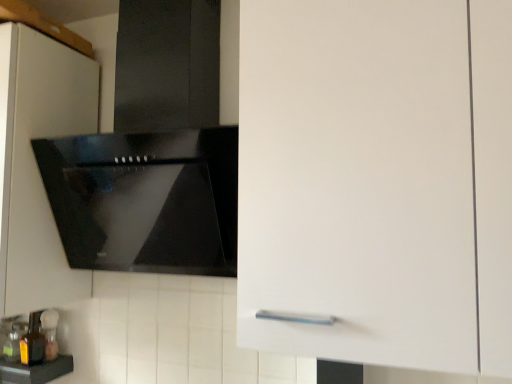
Image resolution: width=512 pixels, height=384 pixels. What do you see at coordinates (32, 341) in the screenshot?
I see `translucent amber bottle at lower left, which appears as the 1th bottle when viewed from the front` at bounding box center [32, 341].

Find the location of a particular element. This screenshot has width=512, height=384. translucent amber bottle at lower left, which appears as the 1th bottle when viewed from the front is located at coordinates (32, 341).

Find the location of a particular element. white matte cabinet at upper left is located at coordinates (36, 164).

This screenshot has width=512, height=384. What do you see at coordinates (49, 333) in the screenshot? I see `translucent glass bottle at lower left, marked as the second bottle in a front-to-back arrangement` at bounding box center [49, 333].

Image resolution: width=512 pixels, height=384 pixels. What do you see at coordinates (35, 370) in the screenshot?
I see `black glossy countertop at lower left` at bounding box center [35, 370].

Image resolution: width=512 pixels, height=384 pixels. In order to click on translucent amber bottle at lower left, which appears as the 1th bottle when viewed from the front in this screenshot , I will do tap(32, 341).

Does translucent amber bottle at lower left, which appears as the 1th bottle when viewed from the front, have a larger size compared to white matte cabinet at upper left?

No, translucent amber bottle at lower left, which appears as the 1th bottle when viewed from the front, is not bigger than white matte cabinet at upper left.

From the picture: Is translucent amber bottle at lower left, which appears as the 1th bottle when viewed from the front, inside or outside of white matte cabinet at upper left?

translucent amber bottle at lower left, which appears as the 1th bottle when viewed from the front, is located beyond the bounds of white matte cabinet at upper left.

Is translucent amber bottle at lower left, which appears as the 1th bottle when viewed from the front, oriented away from white matte cabinet at upper left?

No.

Based on the photo, which object is positioned more to the right, translucent amber bottle at lower left, positioned as the second bottle in back-to-front order, or white matte cabinet at upper left?

translucent amber bottle at lower left, positioned as the second bottle in back-to-front order.

Can you tell me how much black glossy countertop at lower left and translucent amber bottle at lower left, which appears as the 1th bottle when viewed from the front, differ in facing direction?

There is a 1.38-degree angle between the facing directions of black glossy countertop at lower left and translucent amber bottle at lower left, which appears as the 1th bottle when viewed from the front.

Could you tell me if black glossy countertop at lower left is facing translucent amber bottle at lower left, which appears as the 1th bottle when viewed from the front?

No, black glossy countertop at lower left is not turned towards translucent amber bottle at lower left, which appears as the 1th bottle when viewed from the front.

This screenshot has height=384, width=512. I want to click on bottle that is the 1st object to the right of the black glossy countertop at lower left, starting at the anchor, so click(x=32, y=341).

Is black glossy countertop at lower left smaller than translucent amber bottle at lower left, positioned as the second bottle in back-to-front order?

Incorrect, black glossy countertop at lower left is not smaller in size than translucent amber bottle at lower left, positioned as the second bottle in back-to-front order.

From the image's perspective, which one is positioned lower, black glossy countertop at lower left or white matte cabinet at upper left?

black glossy countertop at lower left appears lower in the image.

From a real-world perspective, which is physically below, black glossy countertop at lower left or white matte cabinet at upper left?

black glossy countertop at lower left.

Considering the relative positions of black glossy countertop at lower left and white matte cabinet at upper left in the image provided, is black glossy countertop at lower left in front of white matte cabinet at upper left?

Answer: No, the depth of black glossy countertop at lower left is greater than that of white matte cabinet at upper left.

Between white matte cabinet at upper left and translucent glass bottle at lower left, marked as the second bottle in a front-to-back arrangement, which one has larger width?

With larger width is white matte cabinet at upper left.

How different are the orientations of white matte cabinet at upper left and translucent glass bottle at lower left, marked as the second bottle in a front-to-back arrangement, in degrees?

0.129 degrees.

Can you confirm if white matte cabinet at upper left is shorter than translucent glass bottle at lower left, which ranks as the 1th bottle in back-to-front order?

In fact, white matte cabinet at upper left may be taller than translucent glass bottle at lower left, which ranks as the 1th bottle in back-to-front order.

Between white matte cabinet at upper left and translucent glass bottle at lower left, marked as the second bottle in a front-to-back arrangement, which one has larger size?

Bigger between the two is white matte cabinet at upper left.

From a real-world perspective, is translucent glass bottle at lower left, which ranks as the 1th bottle in back-to-front order, beneath black glossy countertop at lower left?

Actually, translucent glass bottle at lower left, which ranks as the 1th bottle in back-to-front order, is physically above black glossy countertop at lower left in the real world.

From the image's perspective, which is below, translucent glass bottle at lower left, marked as the second bottle in a front-to-back arrangement, or black glossy countertop at lower left?

black glossy countertop at lower left.

Is translucent glass bottle at lower left, which ranks as the 1th bottle in back-to-front order, placed right next to black glossy countertop at lower left?

Yes, the surface of translucent glass bottle at lower left, which ranks as the 1th bottle in back-to-front order, is in contact with black glossy countertop at lower left.

Would you say translucent amber bottle at lower left, which appears as the 1th bottle when viewed from the front, contains black glossy countertop at lower left?

Answer: No, translucent amber bottle at lower left, which appears as the 1th bottle when viewed from the front, does not contain black glossy countertop at lower left.

Based on the photo, is translucent amber bottle at lower left, positioned as the second bottle in back-to-front order, not close to black glossy countertop at lower left?

No.

Which of these two, translucent amber bottle at lower left, which appears as the 1th bottle when viewed from the front, or black glossy countertop at lower left, is bigger?

Bigger between the two is black glossy countertop at lower left.

In terms of height, does translucent amber bottle at lower left, positioned as the second bottle in back-to-front order, look taller or shorter compared to black glossy countertop at lower left?

translucent amber bottle at lower left, positioned as the second bottle in back-to-front order, is taller than black glossy countertop at lower left.

Consider the image. Does translucent amber bottle at lower left, positioned as the second bottle in back-to-front order, have a greater height compared to translucent glass bottle at lower left, which ranks as the 1th bottle in back-to-front order?

Yes.

Considering the positions of points (28, 335) and (44, 310), is point (28, 335) closer to camera compared to point (44, 310)?

Yes, point (28, 335) is in front of point (44, 310).

In the scene shown: Does translucent amber bottle at lower left, positioned as the second bottle in back-to-front order, have a greater width compared to translucent glass bottle at lower left, which ranks as the 1th bottle in back-to-front order?

Indeed, translucent amber bottle at lower left, positioned as the second bottle in back-to-front order, has a greater width compared to translucent glass bottle at lower left, which ranks as the 1th bottle in back-to-front order.

Considering the relative positions of translucent amber bottle at lower left, which appears as the 1th bottle when viewed from the front, and translucent glass bottle at lower left, marked as the second bottle in a front-to-back arrangement, in the image provided, is translucent amber bottle at lower left, which appears as the 1th bottle when viewed from the front, to the left of translucent glass bottle at lower left, marked as the second bottle in a front-to-back arrangement, from the viewer's perspective?

Correct, you'll find translucent amber bottle at lower left, which appears as the 1th bottle when viewed from the front, to the left of translucent glass bottle at lower left, marked as the second bottle in a front-to-back arrangement.

Identify the location of cabinetry that appears above the translucent amber bottle at lower left, positioned as the second bottle in back-to-front order (from a real-world perspective). The width and height of the screenshot is (512, 384). (36, 164).

There is a black glossy countertop at lower left. What are the coordinates of `the 2nd bottle above it (from the image's perspective)` in the screenshot? It's located at 32,341.

When comparing their distances from translucent amber bottle at lower left, positioned as the second bottle in back-to-front order, does white matte cabinet at upper left or black glossy countertop at lower left seem further?

white matte cabinet at upper left is positioned further to the anchor translucent amber bottle at lower left, positioned as the second bottle in back-to-front order.

From the image, which object appears to be farther from translucent glass bottle at lower left, which ranks as the 1th bottle in back-to-front order, translucent amber bottle at lower left, positioned as the second bottle in back-to-front order, or white matte cabinet at upper left?

Among the two, white matte cabinet at upper left is located further to translucent glass bottle at lower left, which ranks as the 1th bottle in back-to-front order.

Based on their spatial positions, is black glossy countertop at lower left or translucent glass bottle at lower left, marked as the second bottle in a front-to-back arrangement, further from white matte cabinet at upper left?

black glossy countertop at lower left lies further to white matte cabinet at upper left than the other object.

Which object lies nearer to the anchor point translucent amber bottle at lower left, which appears as the 1th bottle when viewed from the front, translucent glass bottle at lower left, marked as the second bottle in a front-to-back arrangement, or white matte cabinet at upper left?

translucent glass bottle at lower left, marked as the second bottle in a front-to-back arrangement.

When comparing their distances from white matte cabinet at upper left, does translucent glass bottle at lower left, which ranks as the 1th bottle in back-to-front order, or translucent amber bottle at lower left, positioned as the second bottle in back-to-front order, seem closer?

Based on the image, translucent amber bottle at lower left, positioned as the second bottle in back-to-front order, appears to be nearer to white matte cabinet at upper left.

From the image, which object appears to be farther from white matte cabinet at upper left, translucent amber bottle at lower left, positioned as the second bottle in back-to-front order, or translucent glass bottle at lower left, marked as the second bottle in a front-to-back arrangement?

Based on the image, translucent glass bottle at lower left, marked as the second bottle in a front-to-back arrangement, appears to be further to white matte cabinet at upper left.

When comparing their distances from black glossy countertop at lower left, does translucent glass bottle at lower left, marked as the second bottle in a front-to-back arrangement, or translucent amber bottle at lower left, positioned as the second bottle in back-to-front order, seem further?

translucent glass bottle at lower left, marked as the second bottle in a front-to-back arrangement, is further to black glossy countertop at lower left.

Based on their spatial positions, is white matte cabinet at upper left or black glossy countertop at lower left further from translucent glass bottle at lower left, which ranks as the 1th bottle in back-to-front order?

white matte cabinet at upper left is positioned further to the anchor translucent glass bottle at lower left, which ranks as the 1th bottle in back-to-front order.

You are a GUI agent. You are given a task and a screenshot of the screen. Output one action in this format:
    pyautogui.click(x=<x>, y=<y>)
    Task: Click on the bottle between white matte cabinet at upper left and translucent glass bottle at lower left, which ranks as the 1th bottle in back-to-front order, in the vertical direction
    
    Given the screenshot: What is the action you would take?
    pyautogui.click(x=32, y=341)

Locate an element on the screen. This screenshot has height=384, width=512. bottle that lies between translucent amber bottle at lower left, positioned as the second bottle in back-to-front order, and black glossy countertop at lower left from top to bottom is located at coordinates (49, 333).